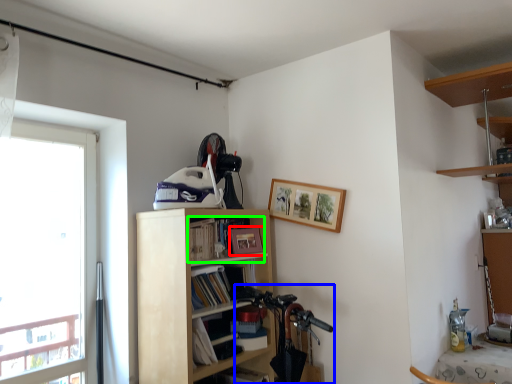
Question: Based on their relative distances, which object is farther from picture frame (highlighted by a red box)? Choose from mountain bike (highlighted by a blue box) and book (highlighted by a green box).

Choices:
 (A) mountain bike
 (B) book

Answer: (A)